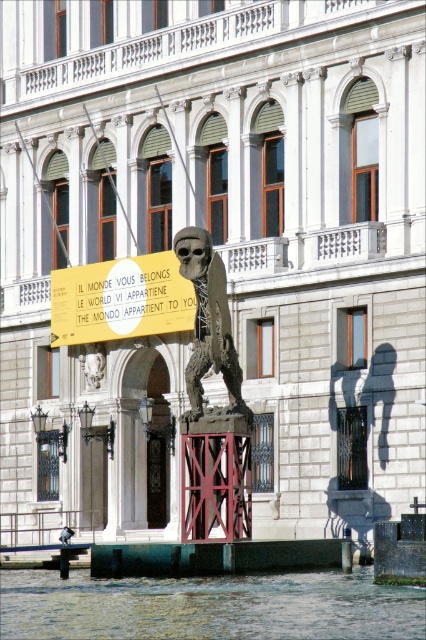
You are a tourist in Venice and want to take a photo of the sculpture. The sculpture has a yellow matte sign at center and a rustic bronze skeleton at center. To ensure both are clearly visible in your photo, should you position yourself in front of or behind the sculpture?

You should position yourself in front of the sculpture because the rustic bronze skeleton at center is behind the yellow matte sign at center. This way, both elements will be visible without one blocking the other.

You are a tourist standing on the platform looking at the sculpture. The clear water at lower center and the rustic bronze skeleton at center are both in view. Which object is shorter in height?

The clear water at lower center has a lesser height compared to rustic bronze skeleton at center, so the clear water at lower center is shorter in height.

You are a tourist in Venice and want to take a photo of the sculpture. The sculpture is on a platform in the canal. There is a clear water at lower center located at point (209, 605). Where should you stand to ensure the sculpture is reflected clearly in the clear water at lower center?

To capture the reflection of the sculpture in the clear water at lower center, you should stand at point (209, 605) where the water is located, ensuring the camera is positioned directly above the water surface to reflect the sculpture.